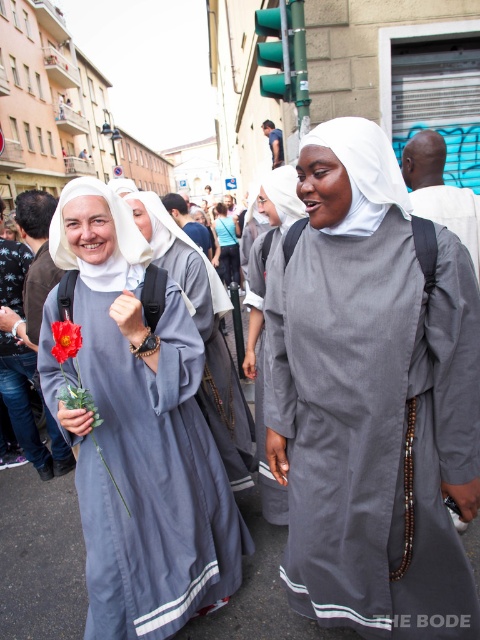
Question: Which object is the closest to the gray matte nun's habit at center?

Choices:
 (A) light blue fabric dress at center
 (B) matte gray robe at center

Answer: (B)

Question: Where is matte gray dress at center located in relation to matte gray robe at center in the image?

Choices:
 (A) left
 (B) right

Answer: (A)

Question: Is gray matte nun's habit at center wider than matte gray robe at center?

Choices:
 (A) no
 (B) yes

Answer: (B)

Question: Is matte gray robe at center below light blue fabric dress at center?

Choices:
 (A) yes
 (B) no

Answer: (A)

Question: Which of the following is the farthest from the observer?

Choices:
 (A) light blue fabric dress at center
 (B) gray matte nun's habit at center
 (C) matte gray robe at center
 (D) matte gray dress at center

Answer: (A)

Question: Estimate the real-world distances between objects in this image. Which object is closer to the matte gray robe at center?

Choices:
 (A) vivid red fabric flower at center
 (B) light blue fabric dress at center
 (C) gray matte nun's habit at center

Answer: (C)